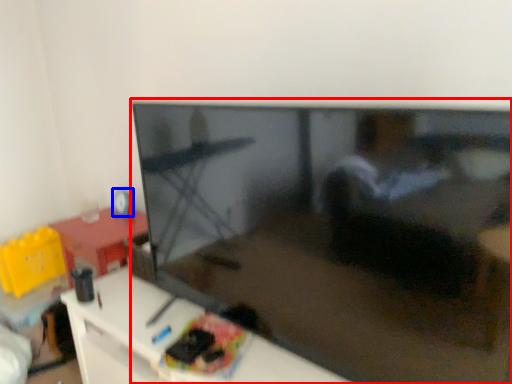
Question: Which of the following is the farthest to the observer, television (highlighted by a red box) or toy (highlighted by a blue box)?

Choices:
 (A) television
 (B) toy

Answer: (B)